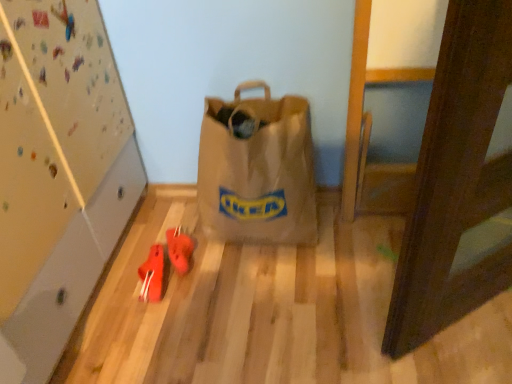
Question: From a real-world perspective, does rubberized red shoes at lower left, the first footwear when ordered from left to right, sit lower than rubberized red shoes at center, which is counted as the 1th footwear, starting from the right?

Choices:
 (A) no
 (B) yes

Answer: (B)

Question: Does rubberized red shoes at lower left, the first footwear when ordered from left to right, contain rubberized red shoes at center, the 2th footwear viewed from the left?

Choices:
 (A) no
 (B) yes

Answer: (A)

Question: Is rubberized red shoes at lower left, the first footwear when ordered from left to right, oriented towards rubberized red shoes at center, which is counted as the 1th footwear, starting from the right?

Choices:
 (A) yes
 (B) no

Answer: (B)

Question: From the image's perspective, is rubberized red shoes at lower left, acting as the 2th footwear starting from the right, on rubberized red shoes at center, the 2th footwear viewed from the left?

Choices:
 (A) yes
 (B) no

Answer: (B)

Question: Is rubberized red shoes at lower left, acting as the 2th footwear starting from the right, thinner than rubberized red shoes at center, the 2th footwear viewed from the left?

Choices:
 (A) no
 (B) yes

Answer: (B)

Question: Looking at their shapes, would you say rubberized red shoes at center, which is counted as the 1th footwear, starting from the right, is wider or thinner than rubberized red shoes at lower left, acting as the 2th footwear starting from the right?

Choices:
 (A) wide
 (B) thin

Answer: (A)

Question: From the image's perspective, relative to rubberized red shoes at lower left, acting as the 2th footwear starting from the right, is rubberized red shoes at center, which is counted as the 1th footwear, starting from the right, above or below?

Choices:
 (A) below
 (B) above

Answer: (B)

Question: Is point (187, 261) closer or farther from the camera than point (161, 269)?

Choices:
 (A) farther
 (B) closer

Answer: (A)

Question: From their relative heights in the image, would you say rubberized red shoes at center, the 2th footwear viewed from the left, is taller or shorter than rubberized red shoes at lower left, acting as the 2th footwear starting from the right?

Choices:
 (A) short
 (B) tall

Answer: (A)

Question: From the image's perspective, is brown paper bag at center located above or below rubberized red shoes at center, the 2th footwear viewed from the left?

Choices:
 (A) above
 (B) below

Answer: (A)

Question: From a real-world perspective, is brown paper bag at center physically located above or below rubberized red shoes at center, the 2th footwear viewed from the left?

Choices:
 (A) above
 (B) below

Answer: (A)

Question: In the image, is brown paper bag at center on the left side or the right side of rubberized red shoes at center, which is counted as the 1th footwear, starting from the right?

Choices:
 (A) left
 (B) right

Answer: (B)

Question: Is point (302, 221) positioned closer to the camera than point (192, 240)?

Choices:
 (A) closer
 (B) farther

Answer: (A)

Question: From a real-world perspective, is rubberized red shoes at lower left, the first footwear when ordered from left to right, above or below brown paper bag at center?

Choices:
 (A) below
 (B) above

Answer: (A)

Question: From the image's perspective, relative to brown paper bag at center, is rubberized red shoes at lower left, the first footwear when ordered from left to right, above or below?

Choices:
 (A) above
 (B) below

Answer: (B)